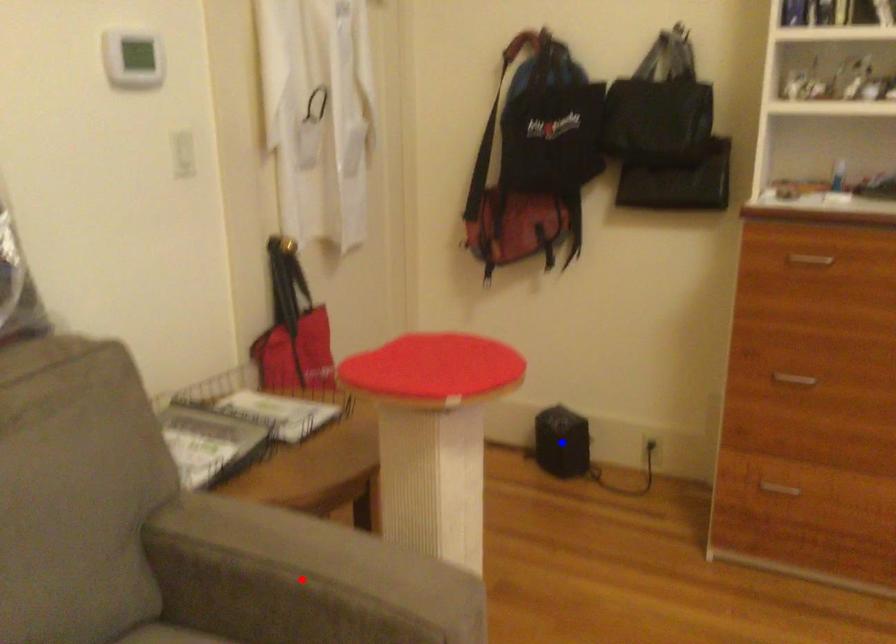
Question: Which of the two points in the image is closer to the camera?

Choices:
 (A) Blue point is closer.
 (B) Red point is closer.

Answer: (B)